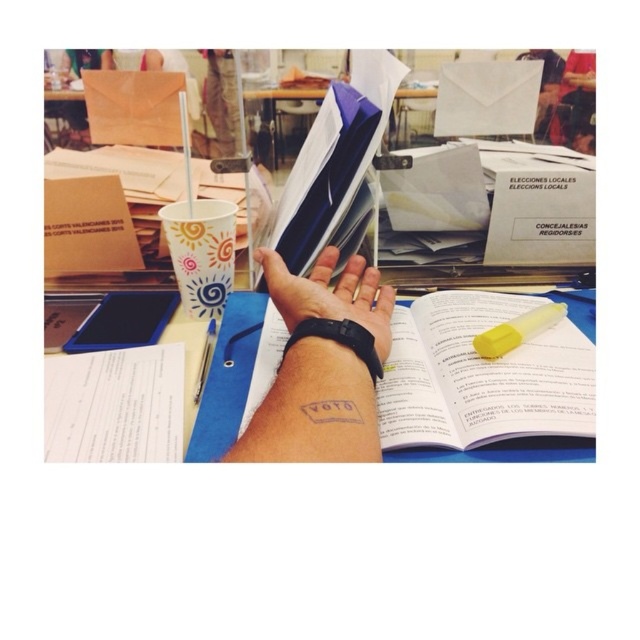
Based on the scene at the polling station, where is the white paper book at center located relative to the light skin tone hand at center?

The white paper book at center is to the right of light skin tone hand at center.

From the picture: You are a voter at an election station and you see the white paper book at center and the light skin tone hand at center. Which object is closer to you?

The white paper book at center is closer to you because it is in front of the light skin tone hand at center.